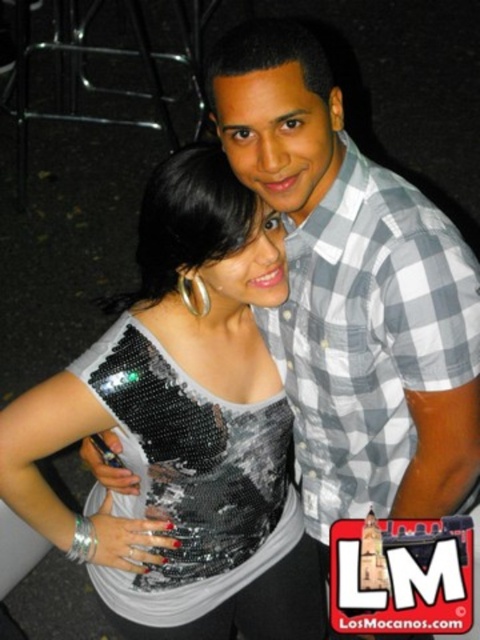
Is sequined fabric top at center smaller than gray checkered shirt at upper right?

Incorrect, sequined fabric top at center is not smaller in size than gray checkered shirt at upper right.

Between point (56, 516) and point (321, 364), which one is positioned behind?

The point (56, 516) is behind.

Which is in front, point (27, 516) or point (276, 340)?

Point (27, 516)

Where is `sequined fabric top at center`? sequined fabric top at center is located at coordinates (184, 426).

Does sequined fabric top at center have a greater width compared to sequined fabric dress at center?

Indeed, sequined fabric top at center has a greater width compared to sequined fabric dress at center.

Who is more forward, (312, 582) or (144, 579)?

Point (144, 579) is in front.

I want to click on sequined fabric top at center, so pyautogui.click(x=184, y=426).

Does gray checkered shirt at upper right have a smaller size compared to sequined fabric dress at center?

Incorrect, gray checkered shirt at upper right is not smaller in size than sequined fabric dress at center.

Between gray checkered shirt at upper right and sequined fabric dress at center, which one has more height?

Standing taller between the two is gray checkered shirt at upper right.

The image size is (480, 640). What do you see at coordinates (369, 333) in the screenshot?
I see `gray checkered shirt at upper right` at bounding box center [369, 333].

Find the location of a particular element. gray checkered shirt at upper right is located at coordinates (369, 333).